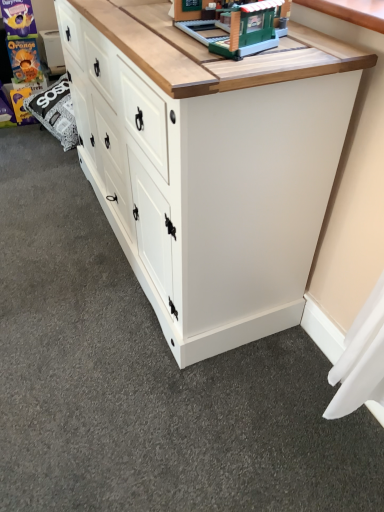
I want to click on free location to the left of green plastic building at upper center, so click(152, 31).